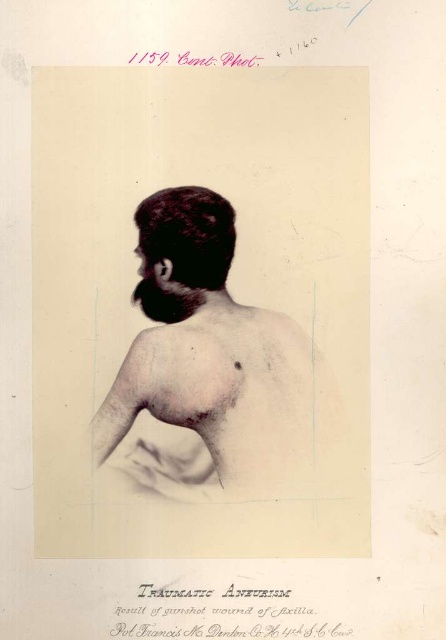
Question: Can you confirm if smooth skin back at center is bigger than dark matte hair at center?

Choices:
 (A) no
 (B) yes

Answer: (B)

Question: Can you confirm if smooth skin back at center is positioned to the left of dark matte hair at center?

Choices:
 (A) yes
 (B) no

Answer: (B)

Question: Is smooth skin back at center closer to camera compared to dark matte hair at center?

Choices:
 (A) no
 (B) yes

Answer: (B)

Question: Which point is farther to the camera?

Choices:
 (A) smooth skin back at center
 (B) dark matte hair at center

Answer: (B)

Question: Which object appears closest to the camera in this image?

Choices:
 (A) smooth skin back at center
 (B) dark matte hair at center

Answer: (A)